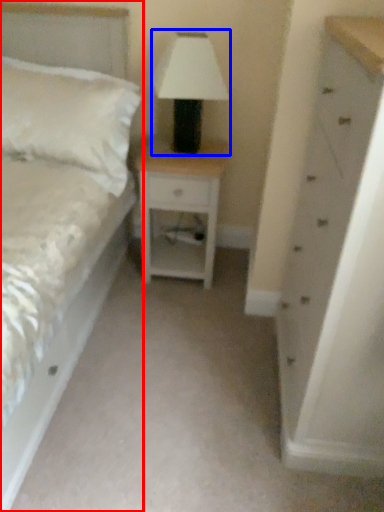
Question: Which object is closer to the camera taking this photo, bed (highlighted by a red box) or table lamp (highlighted by a blue box)?

Choices:
 (A) bed
 (B) table lamp

Answer: (A)